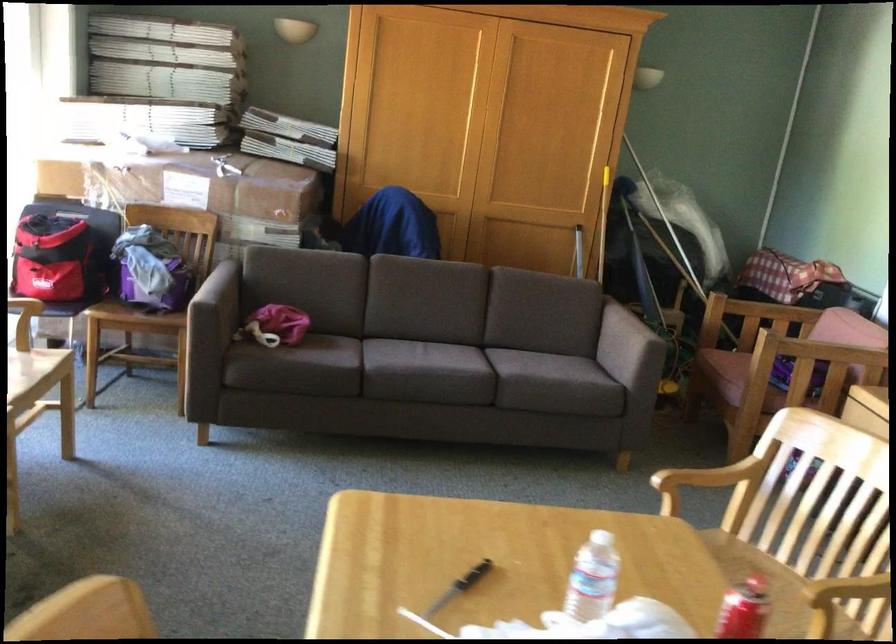
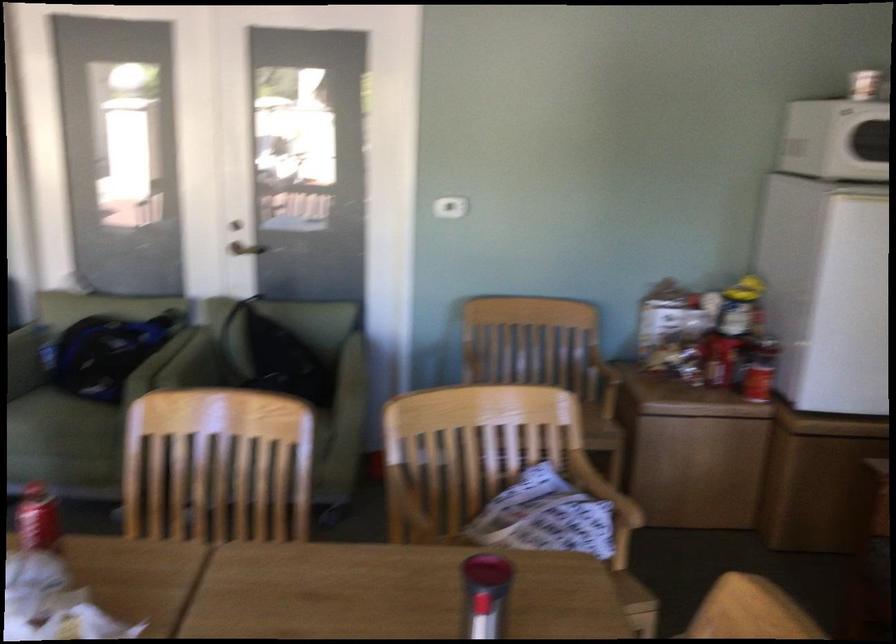
First-person continuous shooting, in which direction is the camera rotating?

The rotation direction of the camera is right-down.